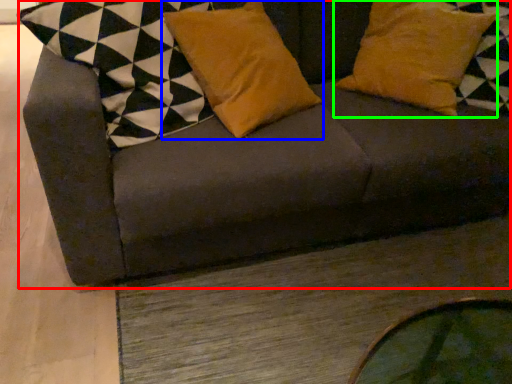
Question: Considering the real-world distances, which object is farthest from studio couch (highlighted by a red box)? pillow (highlighted by a blue box) or pillow (highlighted by a green box)?

Choices:
 (A) pillow
 (B) pillow

Answer: (B)